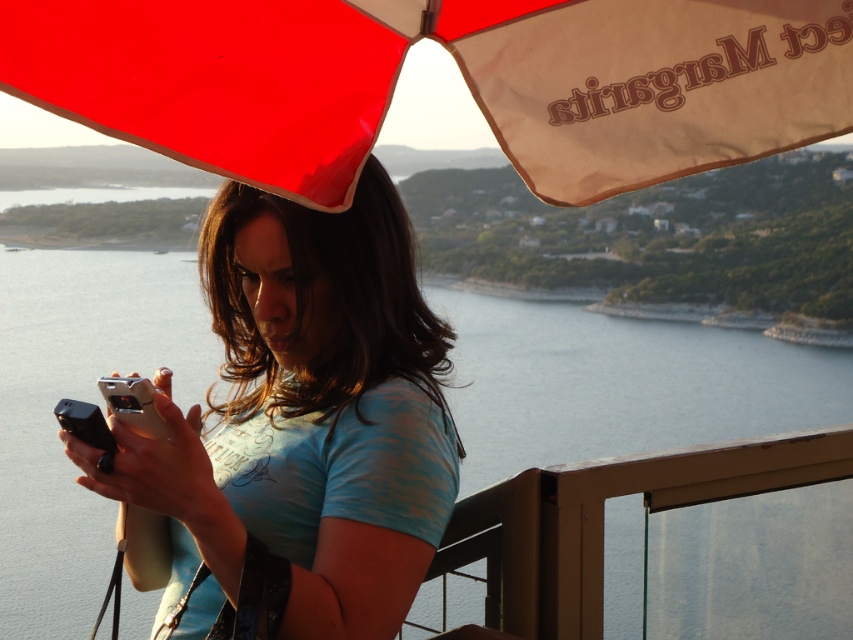
Question: Which point appears farthest from the camera in this image?

Choices:
 (A) (708, 164)
 (B) (173, 554)

Answer: (A)

Question: Can you confirm if clear water at center is positioned below red fabric umbrella at upper center?

Choices:
 (A) no
 (B) yes

Answer: (B)

Question: Can you confirm if clear water at center is positioned above red fabric umbrella at upper center?

Choices:
 (A) yes
 (B) no

Answer: (B)

Question: Which point is closer to the camera?

Choices:
 (A) (136, 60)
 (B) (535, 340)
 (C) (212, 472)

Answer: (A)

Question: Which point is closer to the camera?

Choices:
 (A) matte blue shirt at center
 (B) clear water at center
 (C) red fabric umbrella at upper center

Answer: (C)

Question: Can you confirm if clear water at center is thinner than matte blue shirt at center?

Choices:
 (A) yes
 (B) no

Answer: (B)